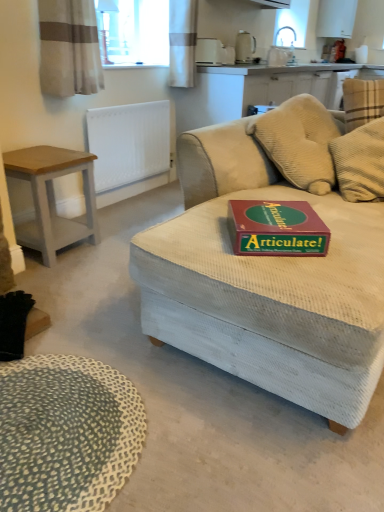
I want to click on blank space situated above maroon cardboard game box at center (from a real-world perspective), so click(x=278, y=216).